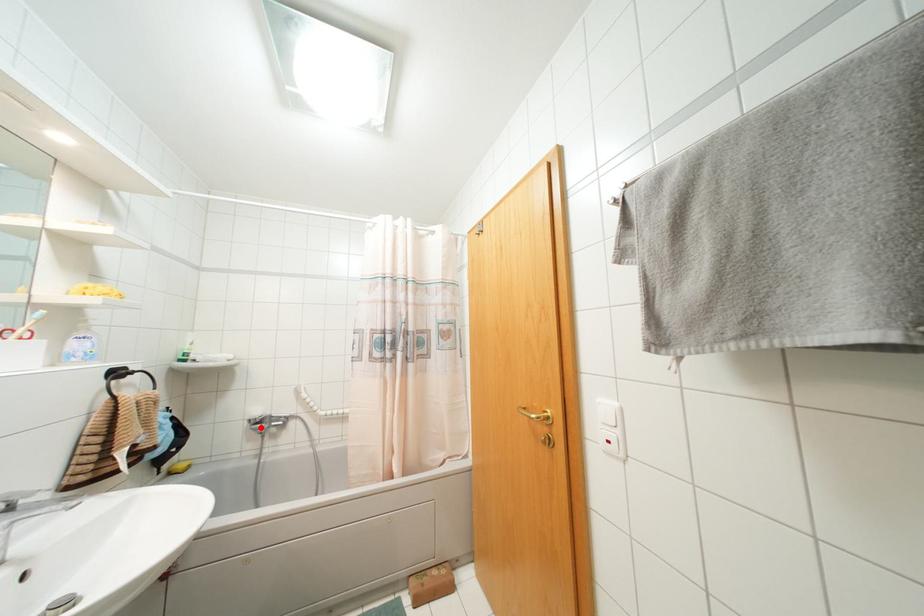
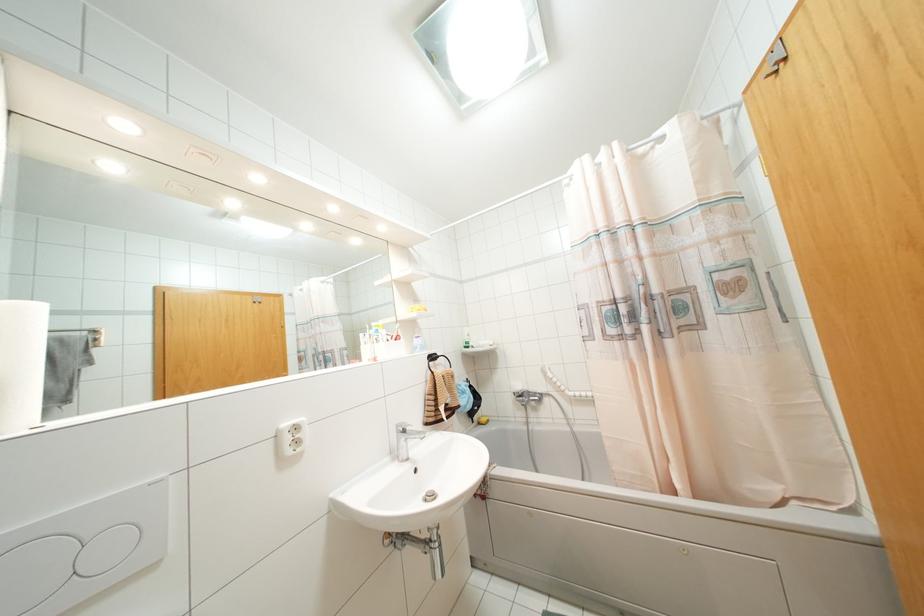
In the second image, find the point that corresponds to the highlighted location in the first image.

(523, 400)